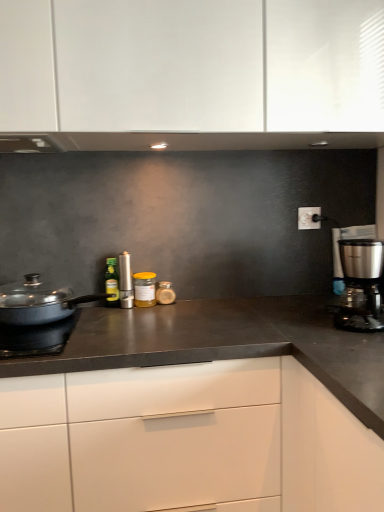
You are a GUI agent. You are given a task and a screenshot of the screen. Output one action in this format:
    pyautogui.click(x=<x>, y=<y>)
    Task: Click on the vacant area in front of yellow glass jar at center, marked as the third kitchen appliance in a right-to-left arrangement
    The width and height of the screenshot is (384, 512).
    Given the screenshot: What is the action you would take?
    pyautogui.click(x=140, y=314)